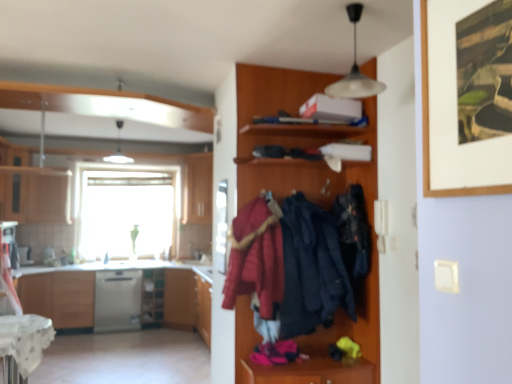
Locate an element on the screen. The width and height of the screenshot is (512, 384). velvet red coat at center, acting as the third clothing starting from the right is located at coordinates (256, 258).

Describe the element at coordinates (49, 195) in the screenshot. The width and height of the screenshot is (512, 384). I see `matte wood cabinet at left, acting as the 2th cabinetry starting from the left` at that location.

What is the approximate width of dark blue fabric coat at center, arranged as the 2th clothing when viewed from the right?

dark blue fabric coat at center, arranged as the 2th clothing when viewed from the right, is 14.36 inches wide.

This screenshot has width=512, height=384. What are the coordinates of `white lace tablecloth at lower left` in the screenshot? It's located at (23, 344).

Which object is thinner, wooden cabinet at center, acting as the third cabinetry starting from the left, or transparent glass window at center?

Thinner between the two is transparent glass window at center.

Measure the distance from wooden cabinet at center, acting as the first cabinetry starting from the right, to transparent glass window at center.

28.59 inches.

Considering the relative sizes of wooden cabinet at center, acting as the third cabinetry starting from the left, and transparent glass window at center in the image provided, is wooden cabinet at center, acting as the third cabinetry starting from the left, bigger than transparent glass window at center?

Incorrect, wooden cabinet at center, acting as the third cabinetry starting from the left, is not larger than transparent glass window at center.

Are wooden cabinet at center, acting as the first cabinetry starting from the right, and transparent glass window at center beside each other?

No, wooden cabinet at center, acting as the first cabinetry starting from the right, is not beside transparent glass window at center.

Is white lace tablecloth at lower left aimed at matte wood cabinet at left, the second cabinetry when ordered from right to left?

No, white lace tablecloth at lower left is not turned towards matte wood cabinet at left, the second cabinetry when ordered from right to left.

Who is bigger, white lace tablecloth at lower left or matte wood cabinet at left, acting as the 2th cabinetry starting from the left?

With larger size is matte wood cabinet at left, acting as the 2th cabinetry starting from the left.

Considering the sizes of objects white lace tablecloth at lower left and matte wood cabinet at left, the second cabinetry when ordered from right to left, in the image provided, who is shorter, white lace tablecloth at lower left or matte wood cabinet at left, the second cabinetry when ordered from right to left,?

white lace tablecloth at lower left.

Is point (17, 383) closer or farther from the camera than point (64, 209)?

Point (17, 383) is positioned closer to the camera compared to point (64, 209).

Is matte wood cabinet at left, the 3th cabinetry in the right-to-left sequence, outside of velvet red coat at center, acting as the 1th clothing starting from the left?

Yes, matte wood cabinet at left, the 3th cabinetry in the right-to-left sequence, is located beyond the bounds of velvet red coat at center, acting as the 1th clothing starting from the left.

Can you confirm if matte wood cabinet at left, which is the 1th cabinetry in left-to-right order, is taller than velvet red coat at center, acting as the third clothing starting from the right?

Yes, matte wood cabinet at left, which is the 1th cabinetry in left-to-right order, is taller than velvet red coat at center, acting as the third clothing starting from the right.

From a real-world perspective, is matte wood cabinet at left, the 3th cabinetry in the right-to-left sequence, located beneath velvet red coat at center, acting as the 1th clothing starting from the left?

No.

Is wooden framed artwork at upper right positioned behind transparent glass screen door at center?

No, it is not.

From the image's perspective, between wooden framed artwork at upper right and transparent glass screen door at center, which one is located above?

wooden framed artwork at upper right is shown above in the image.

Is point (451, 191) closer to camera compared to point (224, 226)?

Yes, it is in front of point (224, 226).

Between matte wood cabinet at left, acting as the 2th cabinetry starting from the left, and white matte pendant light at upper center, which one has more height?

matte wood cabinet at left, acting as the 2th cabinetry starting from the left.

From the image's perspective, which one is positioned higher, matte wood cabinet at left, acting as the 2th cabinetry starting from the left, or white matte pendant light at upper center?

white matte pendant light at upper center appears higher in the image.

Is matte wood cabinet at left, the second cabinetry when ordered from right to left, completely or partially outside of white matte pendant light at upper center?

Absolutely, matte wood cabinet at left, the second cabinetry when ordered from right to left, is external to white matte pendant light at upper center.

From the picture: In terms of size, does wooden coat rack at center appear bigger or smaller than matte wood cabinet at left, acting as the 2th cabinetry starting from the left?

In the image, wooden coat rack at center appears to be larger than matte wood cabinet at left, acting as the 2th cabinetry starting from the left.

Considering the positions of objects wooden coat rack at center and matte wood cabinet at left, the second cabinetry when ordered from right to left, in the image provided, who is in front, wooden coat rack at center or matte wood cabinet at left, the second cabinetry when ordered from right to left,?

wooden coat rack at center is more forward.

Looking at this image, would you say wooden coat rack at center is a long distance from matte wood cabinet at left, acting as the 2th cabinetry starting from the left?

wooden coat rack at center is positioned a significant distance from matte wood cabinet at left, acting as the 2th cabinetry starting from the left.

Would you say wooden coat rack at center is to the left or to the right of matte wood cabinet at left, acting as the 2th cabinetry starting from the left, in the picture?

Based on their positions, wooden coat rack at center is located to the right of matte wood cabinet at left, acting as the 2th cabinetry starting from the left.

Which of these two, white matte pendant light at upper center or wooden framed artwork at upper right, stands shorter?

With less height is white matte pendant light at upper center.

Is white matte pendant light at upper center beside wooden framed artwork at upper right?

They are not placed beside each other.

Considering the sizes of white matte pendant light at upper center and wooden framed artwork at upper right in the image, is white matte pendant light at upper center wider or thinner than wooden framed artwork at upper right?

Clearly, white matte pendant light at upper center has more width compared to wooden framed artwork at upper right.

From the image's perspective, which one is positioned lower, white matte pendant light at upper center or wooden framed artwork at upper right?

From the image's view, wooden framed artwork at upper right is below.

In order to click on cabinetry that is the 2nd object located above the transparent glass window at center (from the image's perspective) in this screenshot , I will do `click(197, 188)`.

I want to click on table in front of the matte wood cabinet at left, acting as the 2th cabinetry starting from the left, so (x=23, y=344).

When comparing their distances from matte wood cabinet at left, the second cabinetry when ordered from right to left, does transparent glass window at center or matte wood cabinet at left, which is the 1th cabinetry in left-to-right order, seem closer?

matte wood cabinet at left, which is the 1th cabinetry in left-to-right order.

From the image, which object appears to be farther from wooden coat rack at center, white matte pendant light at upper center or transparent glass window at center?

The object further to wooden coat rack at center is transparent glass window at center.

Estimate the real-world distances between objects in this image. Which object is further from satin silver dishwasher at center, transparent glass screen door at center or wooden cabinet at center, acting as the first cabinetry starting from the right?

Among the two, transparent glass screen door at center is located further to satin silver dishwasher at center.

Looking at the image, which one is located closer to wooden cabinet at center, acting as the third cabinetry starting from the left, matte wood cabinet at left, acting as the 2th cabinetry starting from the left, or white matte pendant light at upper center?

The object closer to wooden cabinet at center, acting as the third cabinetry starting from the left, is matte wood cabinet at left, acting as the 2th cabinetry starting from the left.

Looking at the image, which one is located further to wooden cabinet at center, acting as the third cabinetry starting from the left, white matte pendant light at upper center or transparent glass screen door at center?

Among the two, white matte pendant light at upper center is located further to wooden cabinet at center, acting as the third cabinetry starting from the left.

When comparing their distances from satin silver dishwasher at center, does velvet red coat at center, acting as the 1th clothing starting from the left, or dark blue fabric coat at center, arranged as the third clothing when viewed from the left, seem further?

The object further to satin silver dishwasher at center is dark blue fabric coat at center, arranged as the third clothing when viewed from the left.

From the image, which object appears to be farther from matte wood cabinet at left, the 3th cabinetry in the right-to-left sequence, dark blue fabric coat at center, arranged as the 2th clothing when viewed from the right, or velvet red coat at center, acting as the 1th clothing starting from the left?

The object further to matte wood cabinet at left, the 3th cabinetry in the right-to-left sequence, is dark blue fabric coat at center, arranged as the 2th clothing when viewed from the right.

Which object lies further to the anchor point wooden shelf at lower left, satin silver dishwasher at center or matte wood cabinet at left, the second cabinetry when ordered from right to left?

The object further to wooden shelf at lower left is matte wood cabinet at left, the second cabinetry when ordered from right to left.

Image resolution: width=512 pixels, height=384 pixels. Identify the location of cupboard between white lace tablecloth at lower left and dark blue fabric coat at center, which is the first clothing in right-to-left order. (294, 138).

Find the location of `screen door positioned between dark blue fabric coat at center, arranged as the third clothing when viewed from the left, and satin silver dishwasher at center from near to far`. screen door positioned between dark blue fabric coat at center, arranged as the third clothing when viewed from the left, and satin silver dishwasher at center from near to far is located at coordinates (221, 226).

Locate an element on the screen. table between dark blue fabric coat at center, arranged as the 2th clothing when viewed from the right, and transparent glass window at center, along the z-axis is located at coordinates click(x=23, y=344).

The image size is (512, 384). In order to click on screen door between white matte pendant light at upper center and transparent glass window at center along the z-axis in this screenshot , I will do `click(221, 226)`.